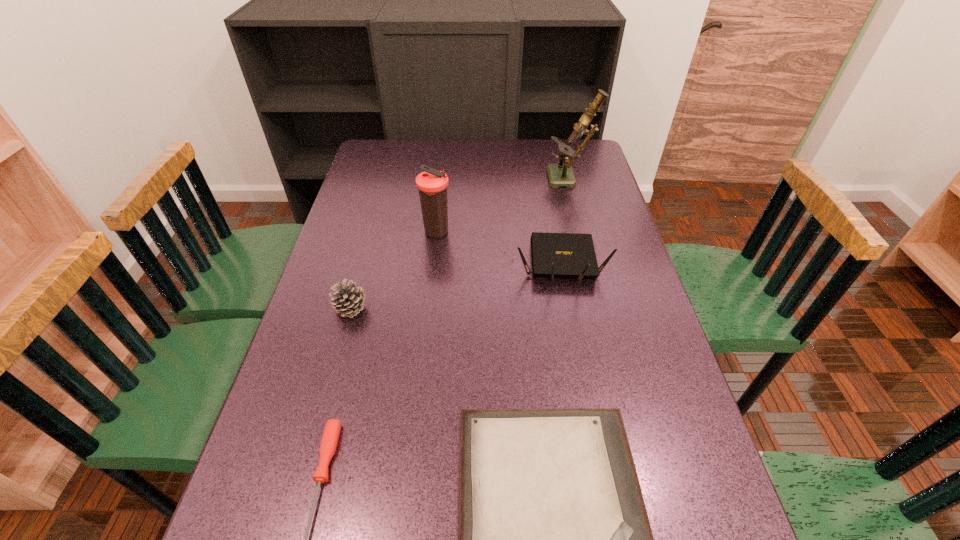
Image resolution: width=960 pixels, height=540 pixels. What are the coordinates of `free spot at the far left corner of the desktop` in the screenshot? It's located at (402, 159).

You are a GUI agent. You are given a task and a screenshot of the screen. Output one action in this format:
    pyautogui.click(x=<x>, y=<y>)
    Task: Click on the free space between the tallest object and the fourth farthest object
    The image size is (960, 540).
    Given the screenshot: What is the action you would take?
    pos(461,244)

Identify the location of free spot between the router and the thermos bottle. (499, 248).

Where is `empty space that is in between the tallest object and the thermos bottle`? Image resolution: width=960 pixels, height=540 pixels. empty space that is in between the tallest object and the thermos bottle is located at coordinates (504, 206).

Locate an element on the screen. The height and width of the screenshot is (540, 960). free space between the router and the third object from left to right is located at coordinates (499, 248).

Image resolution: width=960 pixels, height=540 pixels. Find the location of `object that ranks as the fourth closest to the pinecone`. object that ranks as the fourth closest to the pinecone is located at coordinates [x=554, y=255].

Identify the location of object that stands as the third closest to the router. The height and width of the screenshot is (540, 960). (554, 539).

The image size is (960, 540). Find the location of `free space that satisfies the following two spatial constraints: 1. at the eyepiece of the microscope; 2. on the front side of the third shortest object`. free space that satisfies the following two spatial constraints: 1. at the eyepiece of the microscope; 2. on the front side of the third shortest object is located at coordinates (604, 308).

Image resolution: width=960 pixels, height=540 pixels. What are the coordinates of `vacant space that satisfies the following two spatial constraints: 1. at the eyepiece of the farthest object; 2. on the front side of the fourth object from right to left` in the screenshot? It's located at (585, 233).

You are a GUI agent. You are given a task and a screenshot of the screen. Output one action in this format:
    pyautogui.click(x=<x>, y=<y>)
    Task: Click on the free space in the image that satisfies the following two spatial constraints: 1. on the back side of the pinecone; 2. on the right side of the fourth object from right to left
    This screenshot has width=960, height=540.
    Given the screenshot: What is the action you would take?
    pyautogui.click(x=372, y=233)